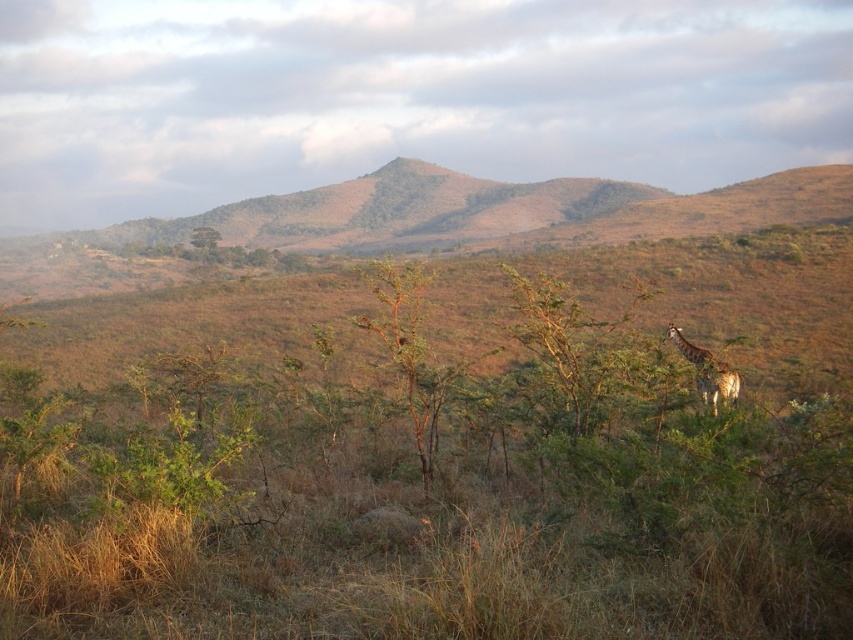
In the scene shown: You are an explorer in the savanna and need to locate the green leafy tree at upper center. Given that you are facing the image, which direction should you turn to find the spotted fur giraffe at right?

The spotted fur giraffe at right is to the right of the green leafy tree at upper center, so you should turn to your right to locate it.

You are standing at the camera position and want to reach point (708, 403). Is the distance less than 15 meters?

The distance of point (708, 403) from camera is 10.82 meters, so yes, the distance is less than 15 meters.

You are an animal researcher observing the savanna. You notice the spotted fur giraffe at right and the green leafy tree at upper center. Which object appears narrower in the image?

The spotted fur giraffe at right appears narrower than the green leafy tree at upper center.